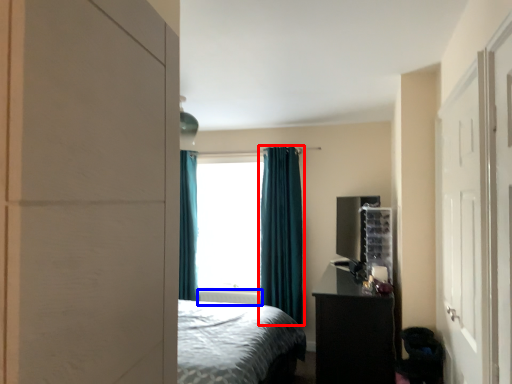
Question: Which of the following is the closest to the observer, curtain (highlighted by a red box) or radiator (highlighted by a blue box)?

Choices:
 (A) curtain
 (B) radiator

Answer: (A)